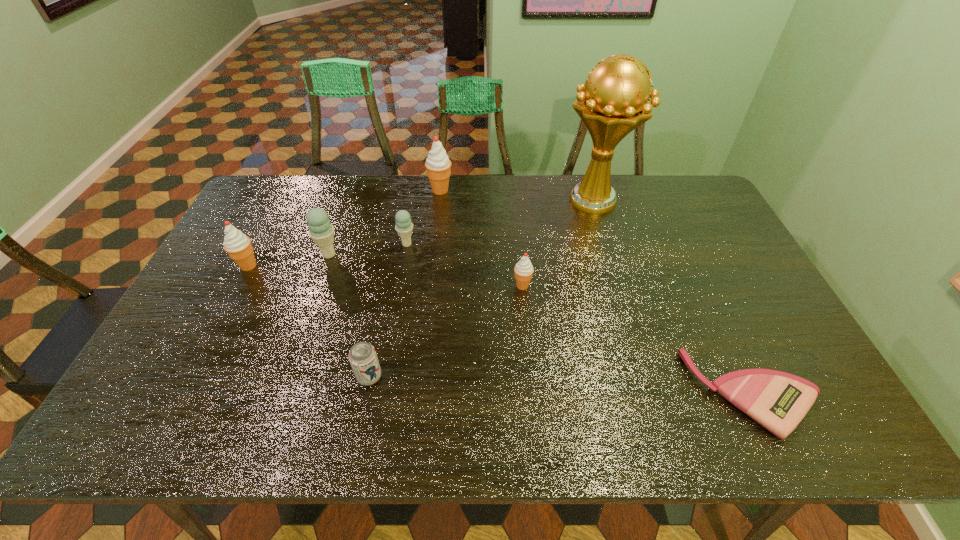
At what (x,y) coordinates should I click in order to perform the action: click on trophy_cup. Please return your answer as a coordinate pair (x, y). This screenshot has height=540, width=960. Looking at the image, I should click on (613, 101).

At what (x,y) coordinates should I click in order to perform the action: click on the tallest object. Please return your answer as a coordinate pair (x, y). Looking at the image, I should click on click(x=613, y=101).

This screenshot has height=540, width=960. Find the location of `the farthest icecream`. the farthest icecream is located at coordinates click(x=438, y=165).

Locate an element on the screen. The image size is (960, 540). the farthest red icecream is located at coordinates (438, 165).

Locate an element on the screen. the second nearest red icecream is located at coordinates (238, 246).

This screenshot has height=540, width=960. I want to click on the leftmost red icecream, so click(238, 246).

I want to click on the bigger blue ice cream, so click(x=321, y=231).

The image size is (960, 540). Identify the location of the seventh object from right to left. (321, 231).

Find the location of a particular element. the smaller blue ice cream is located at coordinates (404, 227).

The width and height of the screenshot is (960, 540). I want to click on the third icecream from right to left, so 404,227.